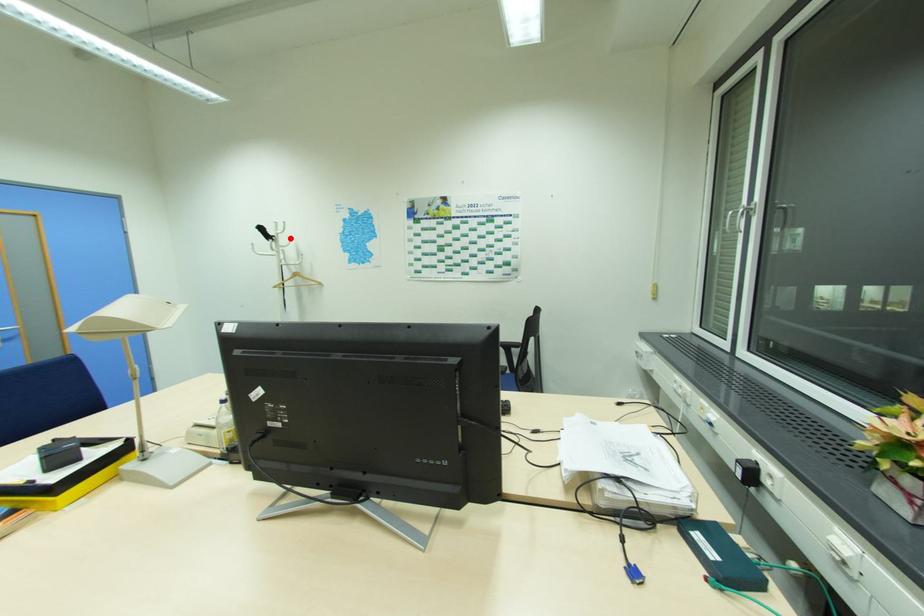
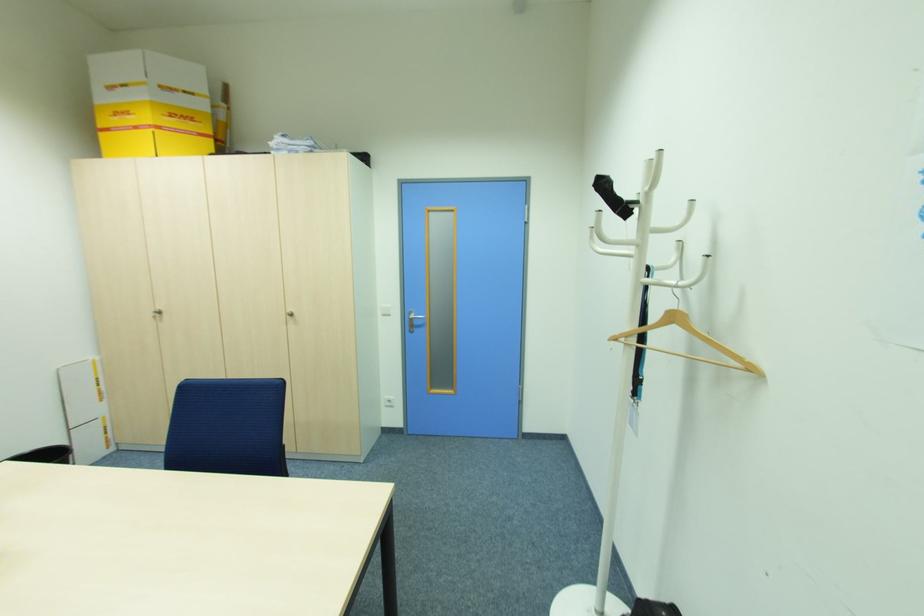
Where in the second image is the point corresponding to the highlighted location from the first image?

(688, 204)